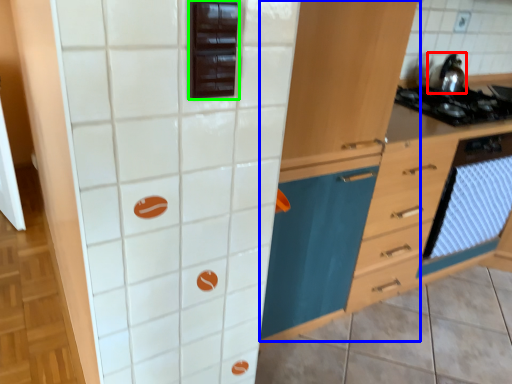
Question: Which object is positioned farthest from kitchen appliance (highlighted by a red box)? Select from cabinetry (highlighted by a blue box) and appliance (highlighted by a green box).

Choices:
 (A) cabinetry
 (B) appliance

Answer: (B)